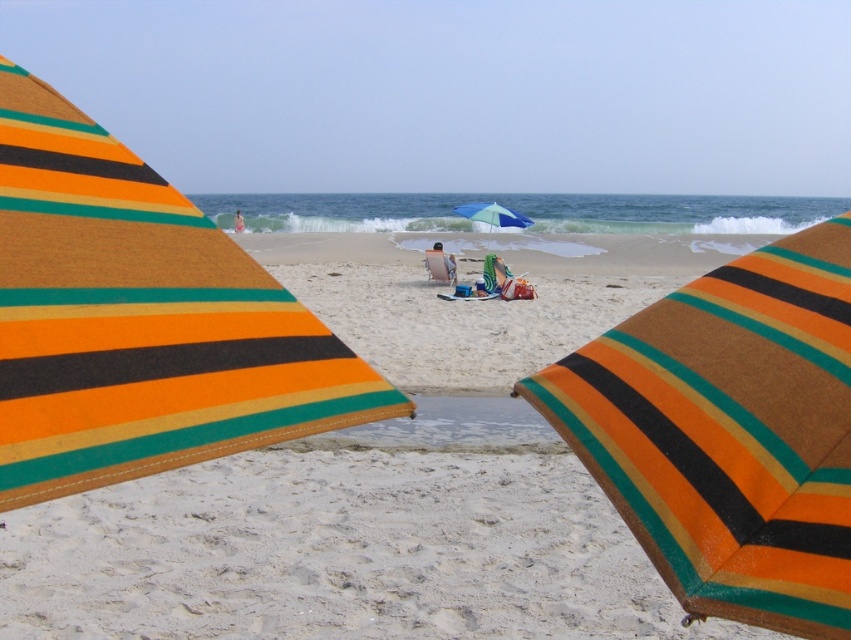
You are holding a camera and want to take a photo of the orange striped fabric umbrella at center. If the camera has a focal length of 50mm, what is the approximate distance in meters between the camera and the umbrella to achieve a sharp focus?

The orange striped fabric umbrella at center and camera are 32.41 inches apart. Converting inches to meters, 32.41 inches is approximately 0.823 meters. To achieve sharp focus, the camera should be positioned about 0.82 meters away from the orange striped fabric umbrella at center.

You are a photographer trying to capture a closeup of the orange striped towel at center. You are currently standing behind the two colorful striped umbrellas. To get the best shot, you need to know which direction to move relative to the skinny pink swimwear at center. Should you move towards it or away from it?

The orange striped towel at center is located below the skinny pink swimwear at center. Since you are behind the umbrellas and want to focus on the towel, you should move towards the skinny pink swimwear at center. This will bring both the towel and swimwear into your frame, ensuring the towel is centered in your shot.